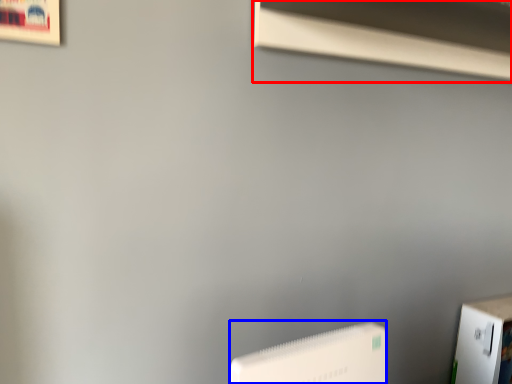
Question: Which object appears farthest to the camera in this image, window sill (highlighted by a red box) or Wii (highlighted by a blue box)?

Choices:
 (A) window sill
 (B) Wii

Answer: (A)